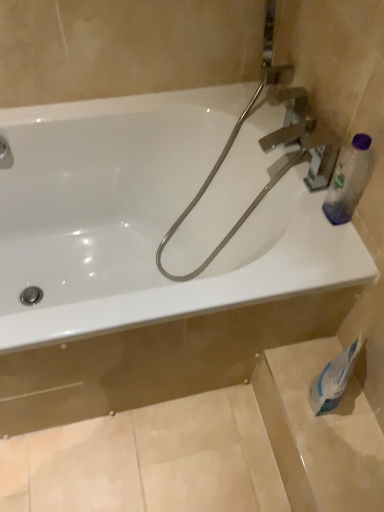
Where is `white paper at lower right`? This screenshot has width=384, height=512. white paper at lower right is located at coordinates (333, 379).

Locate an element on the screen. Image resolution: width=384 pixels, height=512 pixels. metallic silver garden hose at upper right is located at coordinates (212, 179).

At what (x,y) coordinates should I click in order to perform the action: click on white glossy bathtub at upper center. Please return your answer as a coordinate pair (x, y). Looking at the image, I should click on (144, 218).

This screenshot has width=384, height=512. I want to click on matte silver faucet at upper left, so click(x=5, y=154).

I want to click on white paper at lower right, so click(333, 379).

Considering the points (4, 139) and (343, 374), which point is in front, point (4, 139) or point (343, 374)?

The point (343, 374) is closer.

Can you see matte silver faucet at upper left touching white paper at lower right?

matte silver faucet at upper left and white paper at lower right are not in contact.

Looking at this image, is matte silver faucet at upper left bigger than white paper at lower right?

No, matte silver faucet at upper left is not bigger than white paper at lower right.

Between matte silver faucet at upper left and white paper at lower right, which one has more height?

white paper at lower right.

At what (x,y) coordinates should I click in order to perform the action: click on plumbing fixture that appears behind the white glossy bathtub at upper center. Please return your answer as a coordinate pair (x, y). Looking at the image, I should click on (5, 154).

Which of these two, white glossy bathtub at upper center or matte silver faucet at upper left, is smaller?

Smaller between the two is matte silver faucet at upper left.

Between white glossy bathtub at upper center and matte silver faucet at upper left, which one is positioned in front?

white glossy bathtub at upper center is more forward.

Which of these two, matte silver faucet at upper left or transparent plastic bottle at upper right, is wider?

Wider between the two is matte silver faucet at upper left.

From a real-world perspective, is matte silver faucet at upper left positioned under transparent plastic bottle at upper right based on gravity?

Yes, from a real-world perspective, matte silver faucet at upper left is below transparent plastic bottle at upper right.

Is the depth of matte silver faucet at upper left less than that of transparent plastic bottle at upper right?

No, matte silver faucet at upper left is further to the viewer.

How distant is matte silver faucet at upper left from transparent plastic bottle at upper right?

They are 37.01 inches apart.

How different are the orientations of metallic silver garden hose at upper right and white paper at lower right in degrees?

Answer: The facing directions of metallic silver garden hose at upper right and white paper at lower right are 2.17e-05 degrees apart.

Are metallic silver garden hose at upper right and white paper at lower right beside each other?

No, metallic silver garden hose at upper right is not with white paper at lower right.

Relative to white paper at lower right, is metallic silver garden hose at upper right in front or behind?

metallic silver garden hose at upper right is positioned farther from the viewer than white paper at lower right.

From the image's perspective, is metallic silver garden hose at upper right located beneath white paper at lower right?

Actually, metallic silver garden hose at upper right appears above white paper at lower right in the image.

Based on the photo, which of these two, matte silver faucet at upper left or metallic silver garden hose at upper right, stands taller?

metallic silver garden hose at upper right.

Could you tell me if matte silver faucet at upper left is turned towards metallic silver garden hose at upper right?

No.

Is the surface of matte silver faucet at upper left in direct contact with metallic silver garden hose at upper right?

No, matte silver faucet at upper left is not in contact with metallic silver garden hose at upper right.

Is transparent plastic bottle at upper right not inside metallic silver garden hose at upper right?

Yes, transparent plastic bottle at upper right is located beyond the bounds of metallic silver garden hose at upper right.

Between transparent plastic bottle at upper right and metallic silver garden hose at upper right, which one has larger size?

metallic silver garden hose at upper right.

Locate an element on the screen. The height and width of the screenshot is (512, 384). garden hose above the transparent plastic bottle at upper right (from the image's perspective) is located at coordinates (212, 179).

Is white glossy bathtub at upper center placed right next to metallic silver garden hose at upper right?

No, white glossy bathtub at upper center is not making contact with metallic silver garden hose at upper right.

Is white glossy bathtub at upper center taller than metallic silver garden hose at upper right?

Incorrect, the height of white glossy bathtub at upper center is not larger of that of metallic silver garden hose at upper right.

Which object is positioned more to the right, white glossy bathtub at upper center or metallic silver garden hose at upper right?

metallic silver garden hose at upper right is more to the right.

Is white glossy bathtub at upper center positioned with its back to metallic silver garden hose at upper right?

Yes, white glossy bathtub at upper center's orientation is away from metallic silver garden hose at upper right.

Locate an element on the screen. This screenshot has height=512, width=384. plumbing fixture behind the white paper at lower right is located at coordinates (5, 154).

The height and width of the screenshot is (512, 384). In the image, there is a matte silver faucet at upper left. In order to click on bathtub below it (from a real-world perspective) in this screenshot , I will do `click(144, 218)`.

From the image, which object appears to be farther from white paper at lower right, metallic silver garden hose at upper right or matte silver faucet at upper left?

matte silver faucet at upper left is further to white paper at lower right.

Considering their positions, is matte silver faucet at upper left positioned closer to transparent plastic bottle at upper right than white glossy bathtub at upper center?

Answer: Based on the image, white glossy bathtub at upper center appears to be nearer to transparent plastic bottle at upper right.

Looking at this image, based on their spatial positions, is white paper at lower right or matte silver faucet at upper left further from metallic silver garden hose at upper right?

Based on the image, matte silver faucet at upper left appears to be further to metallic silver garden hose at upper right.

From the image, which object appears to be nearer to white glossy bathtub at upper center, matte silver faucet at upper left or transparent plastic bottle at upper right?

matte silver faucet at upper left lies closer to white glossy bathtub at upper center than the other object.

Estimate the real-world distances between objects in this image. Which object is further from transparent plastic bottle at upper right, metallic silver garden hose at upper right or white paper at lower right?

Based on the image, white paper at lower right appears to be further to transparent plastic bottle at upper right.

Based on their spatial positions, is matte silver faucet at upper left or metallic silver garden hose at upper right further from white glossy bathtub at upper center?

matte silver faucet at upper left is further to white glossy bathtub at upper center.

Estimate the real-world distances between objects in this image. Which object is closer to matte silver faucet at upper left, white paper at lower right or metallic silver garden hose at upper right?

metallic silver garden hose at upper right is closer to matte silver faucet at upper left.

When comparing their distances from white paper at lower right, does transparent plastic bottle at upper right or white glossy bathtub at upper center seem further?

Based on the image, white glossy bathtub at upper center appears to be further to white paper at lower right.

The height and width of the screenshot is (512, 384). Find the location of `bathtub that lies between metallic silver garden hose at upper right and white paper at lower right from top to bottom`. bathtub that lies between metallic silver garden hose at upper right and white paper at lower right from top to bottom is located at coordinates (144, 218).

You are a GUI agent. You are given a task and a screenshot of the screen. Output one action in this format:
    pyautogui.click(x=<x>, y=<y>)
    Task: Click on the bottle situated between matte silver faucet at upper left and white paper at lower right from left to right
    
    Given the screenshot: What is the action you would take?
    pyautogui.click(x=349, y=180)

Locate an element on the screen. This screenshot has width=384, height=512. garden hose between matte silver faucet at upper left and white paper at lower right is located at coordinates (212, 179).

Find the location of `bottle between metallic silver garden hose at upper right and white paper at lower right from top to bottom`. bottle between metallic silver garden hose at upper right and white paper at lower right from top to bottom is located at coordinates (349, 180).